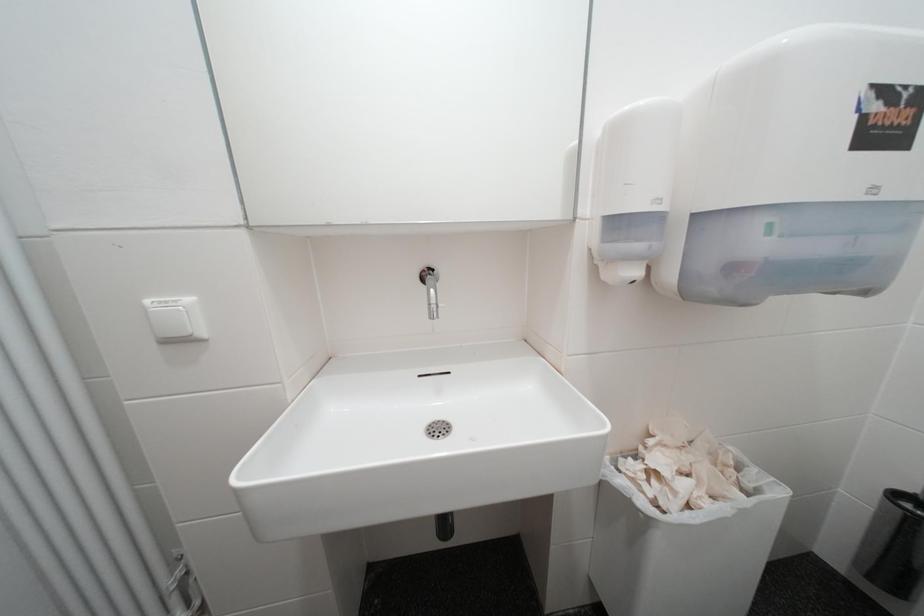
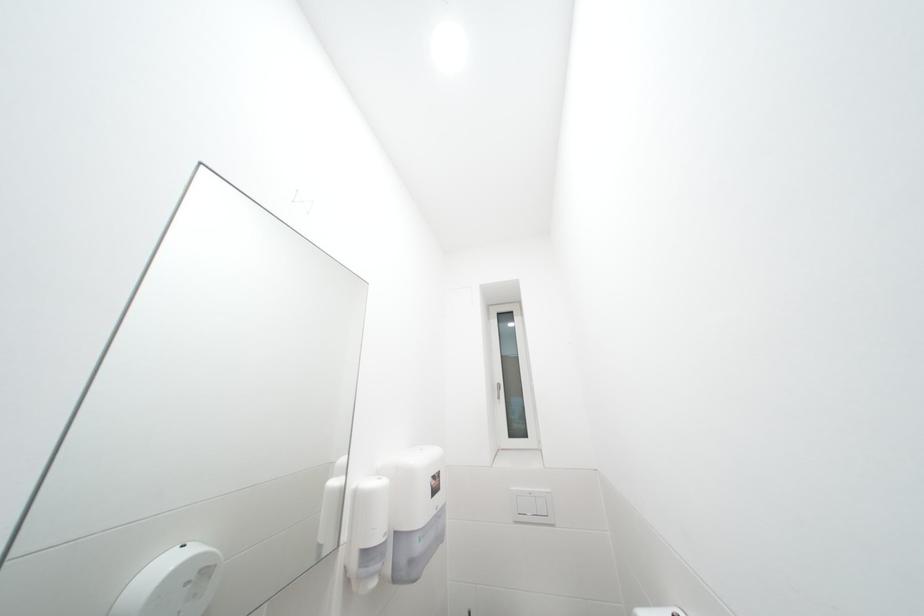
How did the camera likely rotate?

The camera rotated toward right-up.